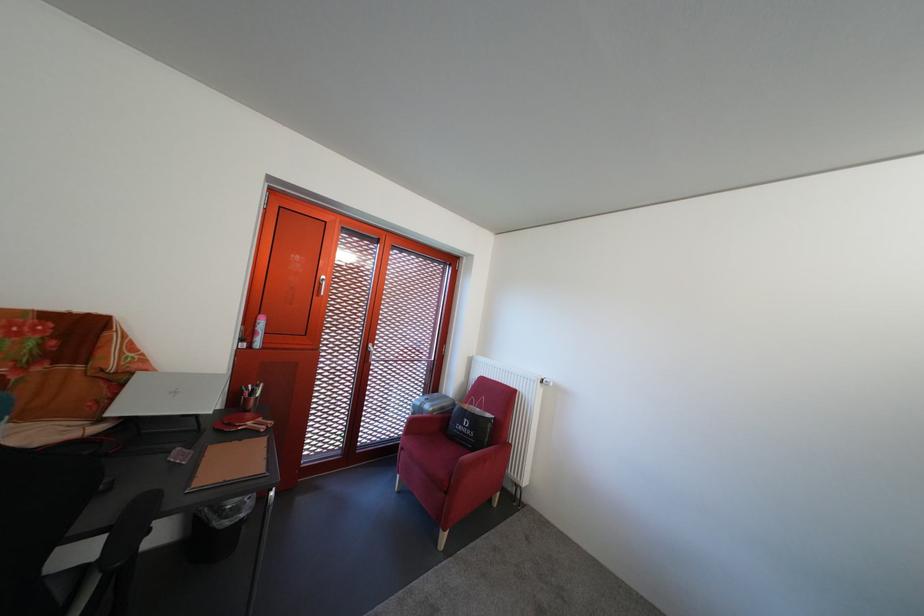
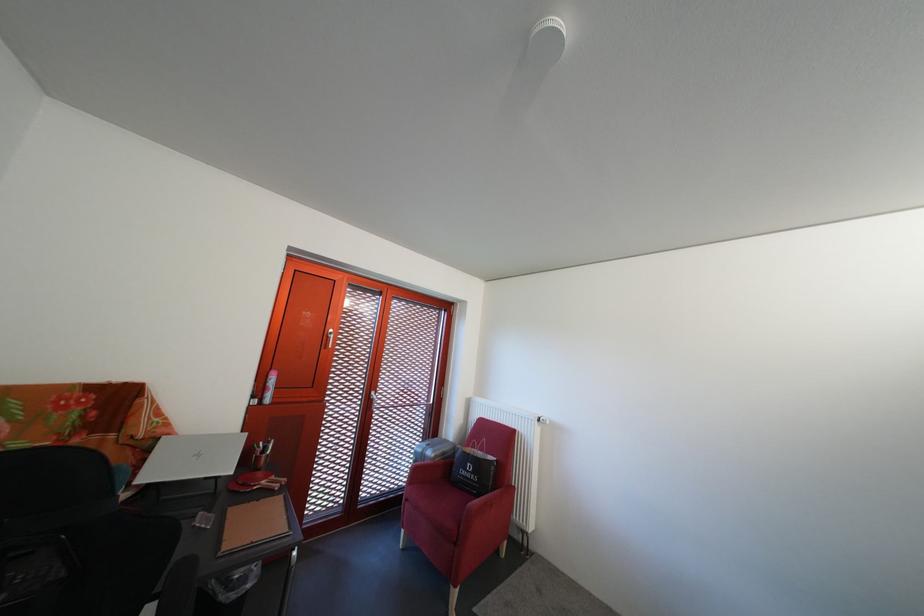
The point at (119, 419) is marked in the first image. Where is the corresponding point in the second image?

(147, 488)